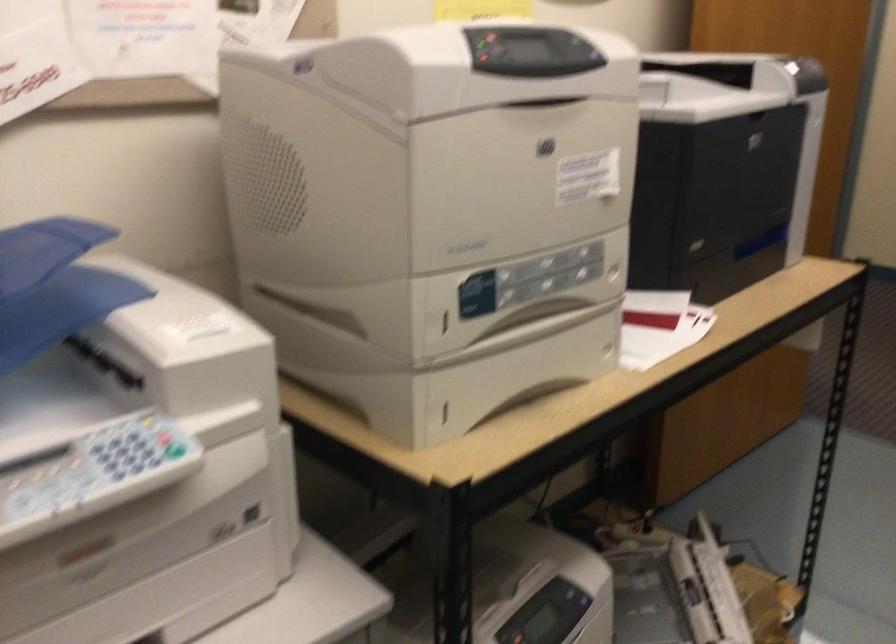
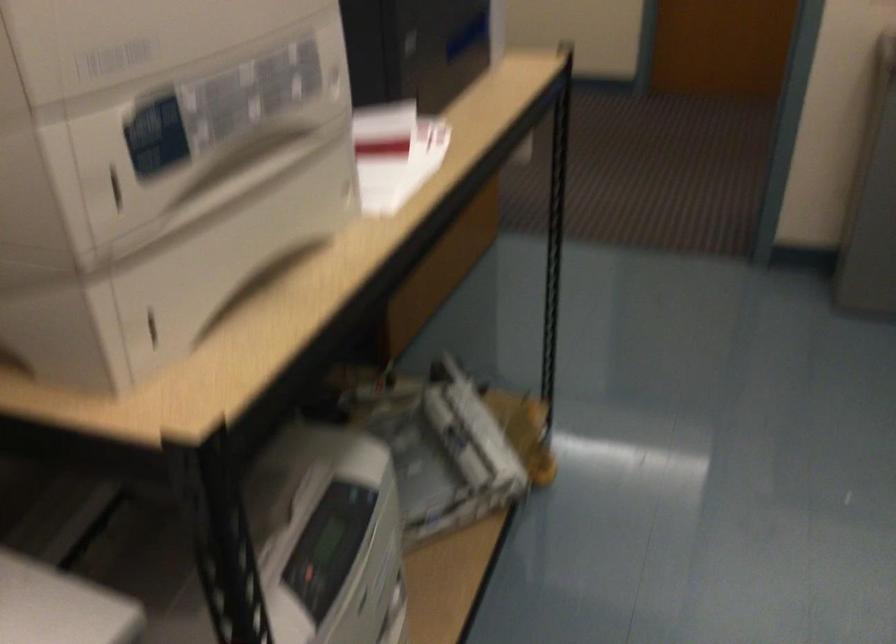
The point at [440,323] is marked in the first image. Where is the corresponding point in the second image?

(116, 189)